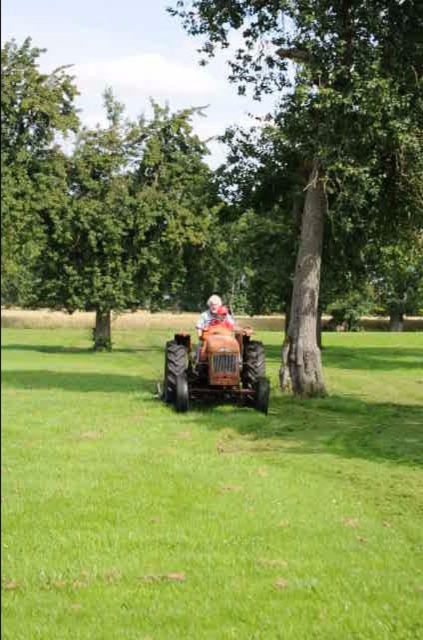
Question: Does green grassy field at center have a smaller size compared to smooth bark tree at center?

Choices:
 (A) no
 (B) yes

Answer: (B)

Question: Can you confirm if green grassy field at center is smaller than smooth bark tree at center?

Choices:
 (A) yes
 (B) no

Answer: (A)

Question: Which point is closer to the camera?

Choices:
 (A) (255, 368)
 (B) (214, 312)
 (C) (136, 342)

Answer: (A)

Question: Which point is closer to the camera taking this photo?

Choices:
 (A) (326, 61)
 (B) (175, 196)
 (C) (313, 534)

Answer: (C)

Question: Observing the image, what is the correct spatial positioning of green grassy field at center in reference to green leafy tree at upper left?

Choices:
 (A) above
 (B) below

Answer: (B)

Question: Which object is farther from the camera taking this photo?

Choices:
 (A) white fabric hat at center
 (B) smooth bark tree at center

Answer: (A)